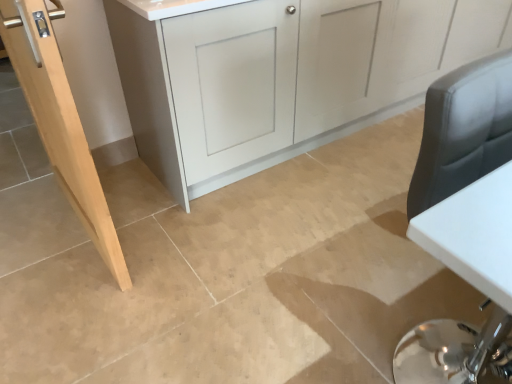
Question: In terms of width, does natural wood door at left look wider or thinner when compared to matte gray cabinet at center?

Choices:
 (A) wide
 (B) thin

Answer: (B)

Question: Is natural wood door at left bigger or smaller than matte gray cabinet at center?

Choices:
 (A) big
 (B) small

Answer: (B)

Question: From their relative heights in the image, would you say natural wood door at left is taller or shorter than matte gray cabinet at center?

Choices:
 (A) tall
 (B) short

Answer: (A)

Question: In terms of size, does matte gray cabinet at center appear bigger or smaller than natural wood door at left?

Choices:
 (A) big
 (B) small

Answer: (A)

Question: Is matte gray cabinet at center spatially inside natural wood door at left, or outside of it?

Choices:
 (A) inside
 (B) outside

Answer: (B)

Question: Is matte gray cabinet at center taller or shorter than natural wood door at left?

Choices:
 (A) short
 (B) tall

Answer: (A)

Question: Would you say matte gray cabinet at center is to the left or to the right of natural wood door at left in the picture?

Choices:
 (A) left
 (B) right

Answer: (B)